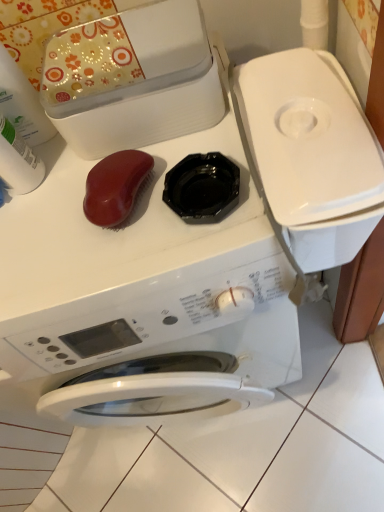
I want to click on vacant area that lies in front of white plastic bottle at left, marked as the 2th cleaning product in a top-to-bottom arrangement, so click(x=61, y=245).